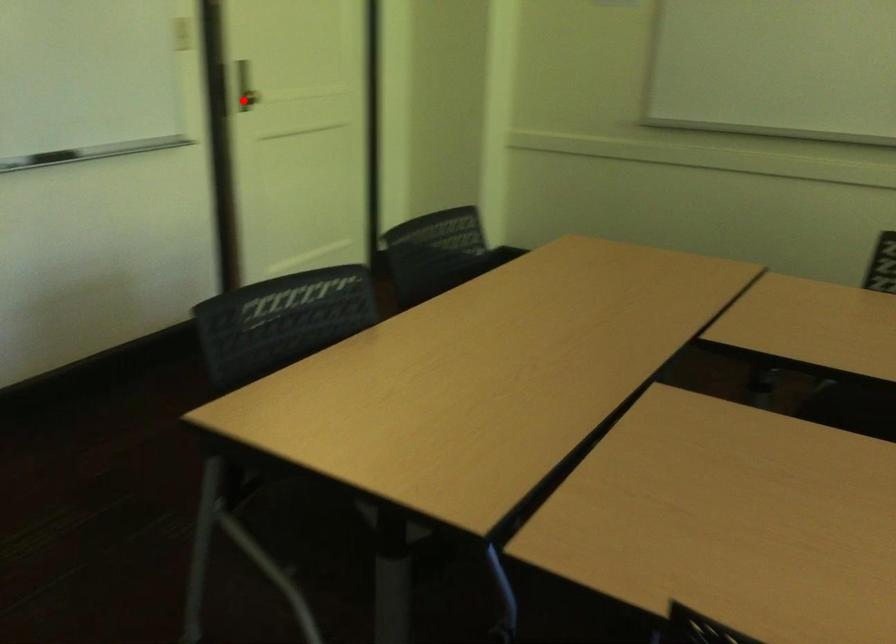
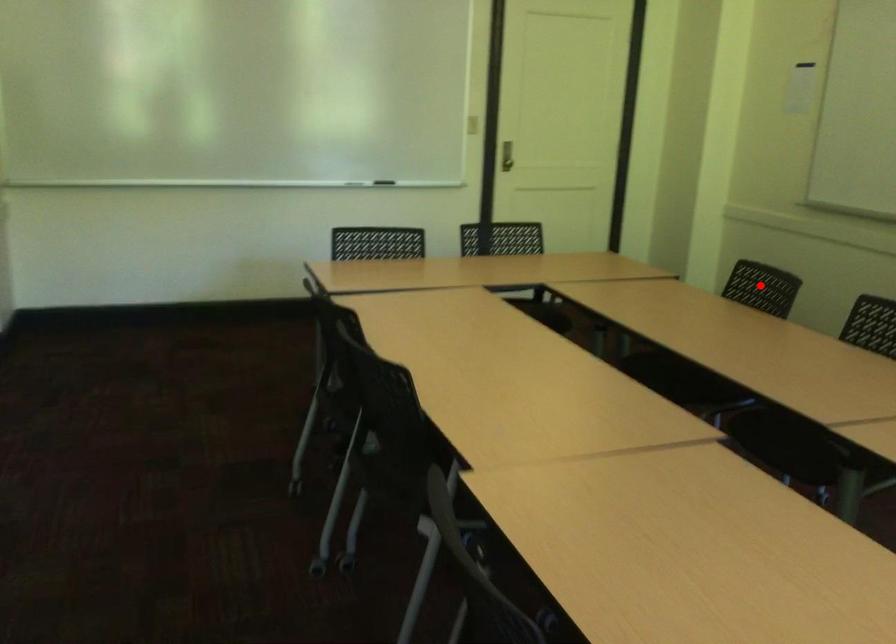
I am providing you with two images of the same scene from different viewpoints. A red point is marked on the first image and another point is marked on the second image. Does the point marked in image1 correspond to the same location as the one in image2?

No